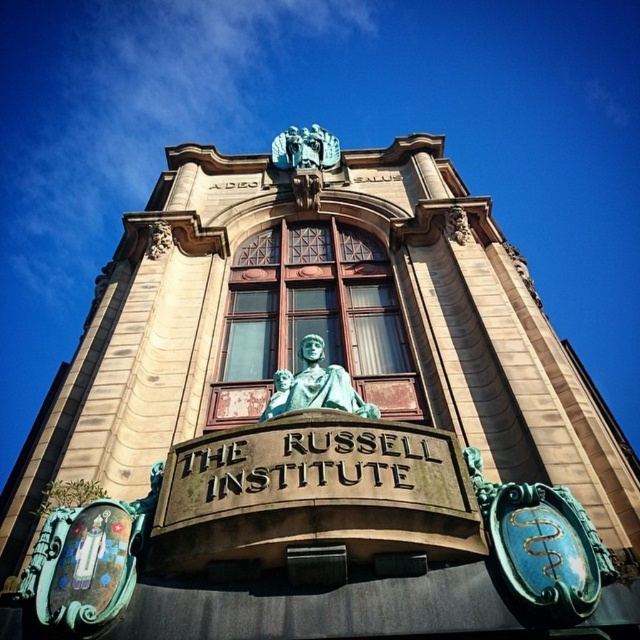
Who is higher up, green patina statue at center or bronze statue at upper center?

bronze statue at upper center is higher up.

At what (x,y) coordinates should I click in order to perform the action: click on green patina statue at center. Please return your answer as a coordinate pair (x, y). Looking at the image, I should click on (316, 385).